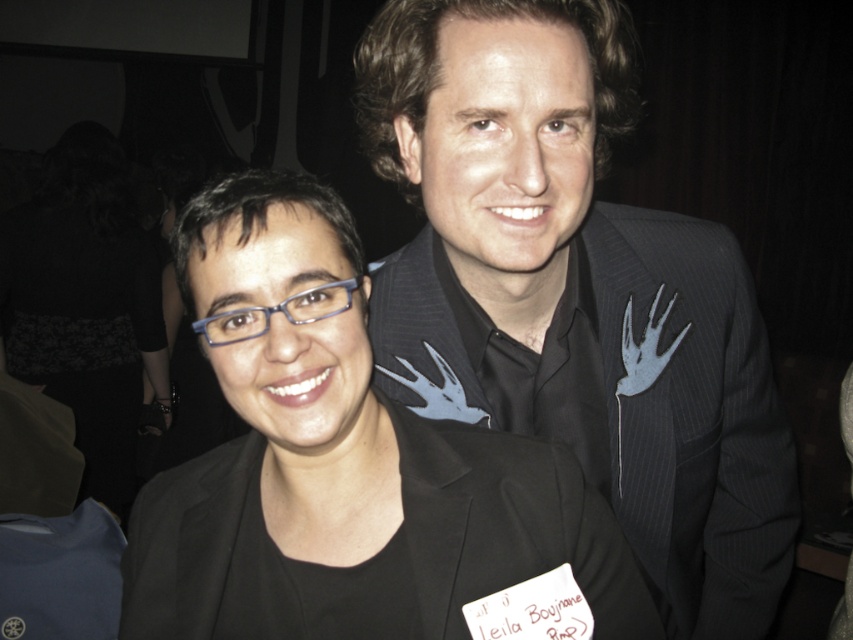
Question: Does dark pinstripe suit at center come in front of black matte/black textured blazer at center?

Choices:
 (A) yes
 (B) no

Answer: (B)

Question: Is dark pinstripe suit at center to the right of black matte/black textured blazer at center from the viewer's perspective?

Choices:
 (A) yes
 (B) no

Answer: (A)

Question: Considering the relative positions of dark pinstripe suit at center and black matte/black textured blazer at center in the image provided, where is dark pinstripe suit at center located with respect to black matte/black textured blazer at center?

Choices:
 (A) below
 (B) above

Answer: (B)

Question: Which point appears closest to the camera in this image?

Choices:
 (A) (743, 326)
 (B) (293, 598)

Answer: (B)

Question: Which point appears farthest from the camera in this image?

Choices:
 (A) (206, 214)
 (B) (740, 480)

Answer: (B)